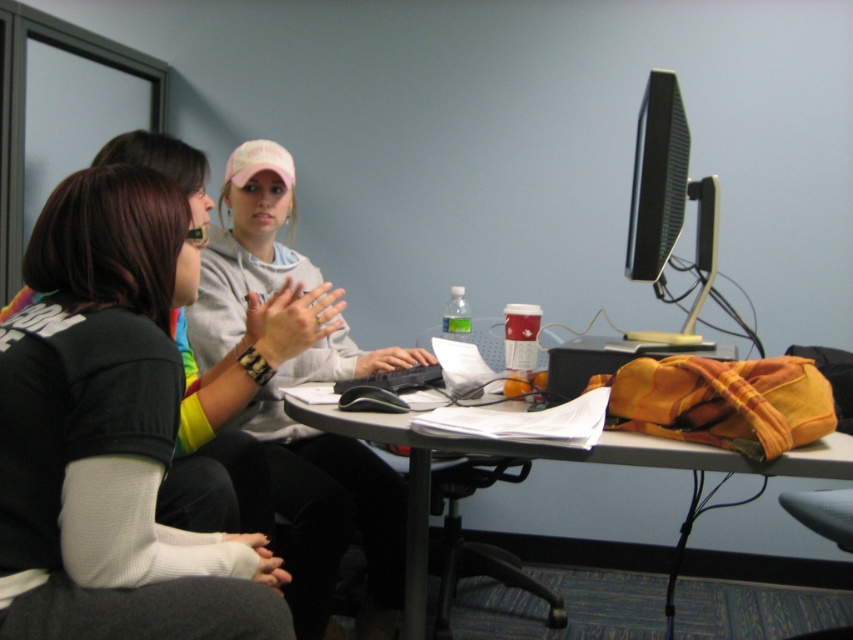
You are trying to reach the black glossy monitor at upper right from your current position behind the gray sweatshirt at center. Can you see the monitor without moving your head?

The gray sweatshirt at center is much taller than the black glossy monitor at upper right, so it might block your view of the monitor unless you move your head or position yourself higher.

You are standing at the entrance of the office and want to reach the gray sweatshirt at center. Which direction should you move in relation to the point marked at (334, 488)?

The gray sweatshirt at center is represented by point (334, 488), so you should move towards that point to reach it.

In the scene shown: You are standing in the office and need to place a new item exactly at the point with coordinates (x=550, y=460). What object is currently located at that position?

The point at coordinates (x=550, y=460) corresponds to the orange fabric bag at center, so placing a new item there would require moving the orange fabric bag at center first.